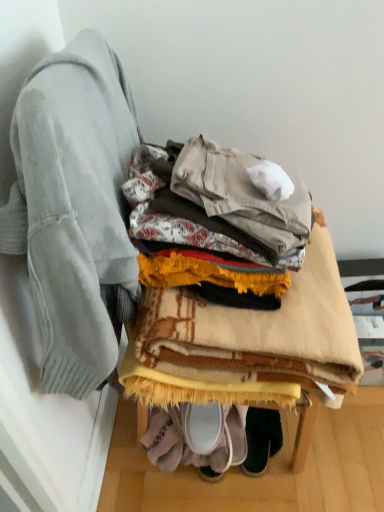
I want to click on light gray sweater at left, so click(74, 210).

At what (x,y) coordinates should I click in order to perform the action: click on beige woven blanket at center. Please return your answer as a coordinate pair (x, y). Looking at the image, I should click on (247, 341).

Locate an element on the screen. Image resolution: width=384 pixels, height=512 pixels. dark green suede shoes at lower center is located at coordinates (261, 439).

Identify the location of light gray sweater at left. (74, 210).

Is light gray sweater at left completely or partially outside of beige woven blanket at center?

Yes, light gray sweater at left is not within beige woven blanket at center.

Which is behind, point (82, 397) or point (347, 310)?

The point (82, 397) is farther.

Measure the distance between light gray sweater at left and beige woven blanket at center.

light gray sweater at left is 9.58 inches from beige woven blanket at center.

Consider the image. Is light gray sweater at left oriented towards beige woven blanket at center?

Yes, light gray sweater at left is facing beige woven blanket at center.

Which is closer to the camera, (76, 228) or (258, 468)?

The point (76, 228) is more forward.

From the image's perspective, which is below, light gray sweater at left or dark green suede shoes at lower center?

dark green suede shoes at lower center, from the image's perspective.

In the image, is light gray sweater at left positioned in front of or behind dark green suede shoes at lower center?

light gray sweater at left is positioned closer to the viewer than dark green suede shoes at lower center.

Is light gray sweater at left touching dark green suede shoes at lower center?

light gray sweater at left is not next to dark green suede shoes at lower center, and they're not touching.

Between dark green suede shoes at lower center and beige woven blanket at center, which one has larger width?

beige woven blanket at center.

Is dark green suede shoes at lower center to the left of beige woven blanket at center from the viewer's perspective?

No, dark green suede shoes at lower center is not to the left of beige woven blanket at center.

Who is smaller, dark green suede shoes at lower center or beige woven blanket at center?

With smaller size is dark green suede shoes at lower center.

Find the location of a particular element. The image size is (384, 512). furniture in front of the dark green suede shoes at lower center is located at coordinates (247, 341).

From a real-world perspective, is beige woven blanket at center located beneath light gray sweater at left?

Yes, from a real-world perspective, beige woven blanket at center is below light gray sweater at left.

Between beige woven blanket at center and light gray sweater at left, which one has less height?

beige woven blanket at center is shorter.

Are beige woven blanket at center and light gray sweater at left far apart?

No, beige woven blanket at center is in close proximity to light gray sweater at left.

Considering the relative sizes of beige woven blanket at center and light gray sweater at left in the image provided, is beige woven blanket at center wider than light gray sweater at left?

Indeed, beige woven blanket at center has a greater width compared to light gray sweater at left.

Considering the relative positions of beige woven blanket at center and dark green suede shoes at lower center in the image provided, is beige woven blanket at center to the left or to the right of dark green suede shoes at lower center?

In the image, beige woven blanket at center appears on the left side of dark green suede shoes at lower center.

This screenshot has width=384, height=512. What are the coordinates of `furniture in front of the dark green suede shoes at lower center` in the screenshot? It's located at (247, 341).

Relative to dark green suede shoes at lower center, is beige woven blanket at center in front or behind?

beige woven blanket at center is positioned closer to the viewer than dark green suede shoes at lower center.

From a real-world perspective, is dark green suede shoes at lower center above or below light gray sweater at left?

In terms of real-world spatial position, dark green suede shoes at lower center is below light gray sweater at left.

Which is in front, point (261, 440) or point (31, 128)?

Positioned in front is point (31, 128).

Looking at their sizes, would you say dark green suede shoes at lower center is wider or thinner than light gray sweater at left?

Considering their sizes, dark green suede shoes at lower center looks broader than light gray sweater at left.

Visually, is dark green suede shoes at lower center positioned to the left or to the right of light gray sweater at left?

dark green suede shoes at lower center is positioned on light gray sweater at left's right side.

Image resolution: width=384 pixels, height=512 pixels. I want to click on furniture that is under the light gray sweater at left (from a real-world perspective), so click(x=247, y=341).

There is a dark green suede shoes at lower center. At what (x,y) coordinates should I click in order to perform the action: click on jacket above it (from a real-world perspective). Please return your answer as a coordinate pair (x, y). This screenshot has height=512, width=384. Looking at the image, I should click on (74, 210).

Looking at the image, which one is located further to light gray sweater at left, dark green suede shoes at lower center or beige woven blanket at center?

dark green suede shoes at lower center lies further to light gray sweater at left than the other object.

Looking at this image, which object lies further to the anchor point beige woven blanket at center, light gray sweater at left or dark green suede shoes at lower center?

dark green suede shoes at lower center is positioned further to the anchor beige woven blanket at center.

Which object lies nearer to the anchor point dark green suede shoes at lower center, beige woven blanket at center or light gray sweater at left?

Among the two, beige woven blanket at center is located nearer to dark green suede shoes at lower center.

Estimate the real-world distances between objects in this image. Which object is closer to beige woven blanket at center, dark green suede shoes at lower center or light gray sweater at left?

light gray sweater at left is positioned closer to the anchor beige woven blanket at center.

Based on their spatial positions, is light gray sweater at left or beige woven blanket at center closer to dark green suede shoes at lower center?

Based on the image, beige woven blanket at center appears to be nearer to dark green suede shoes at lower center.

Considering their positions, is beige woven blanket at center positioned closer to light gray sweater at left than dark green suede shoes at lower center?

beige woven blanket at center.

You are a GUI agent. You are given a task and a screenshot of the screen. Output one action in this format:
    pyautogui.click(x=<x>, y=<y>)
    Task: Click on the furniture located between light gray sweater at left and dark green suede shoes at lower center in the depth direction
    The height and width of the screenshot is (512, 384).
    Given the screenshot: What is the action you would take?
    pyautogui.click(x=247, y=341)